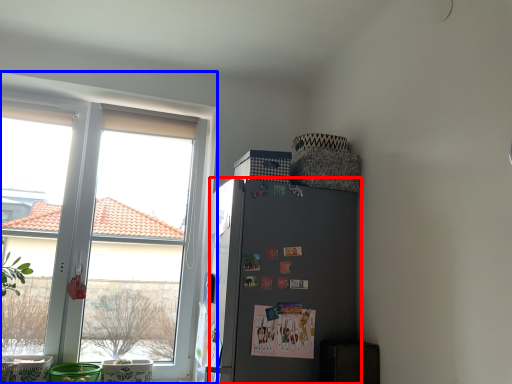
Question: Among these objects, which one is nearest to the camera, refrigerator (highlighted by a red box) or window (highlighted by a blue box)?

Choices:
 (A) refrigerator
 (B) window

Answer: (A)